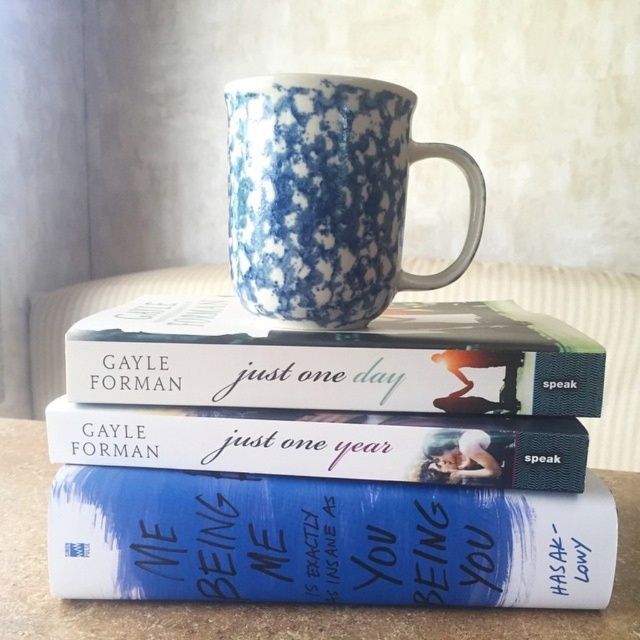
You are organizing a bookshelf and see the white matte book at center and the blue textured book at center. Which book should you place to the right if you want to maintain their current arrangement?

You should place the white matte book at center to the right of the blue textured book at center to maintain their current arrangement since the white matte book at center is already positioned on the right side of the blue textured book at center.